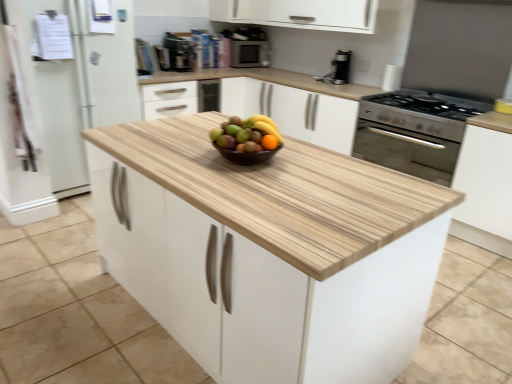
Measure the distance between natural wood cabinet at center, which is counted as the 3th cabinetry, starting from the back, and camera.

natural wood cabinet at center, which is counted as the 3th cabinetry, starting from the back, and camera are 3.87 feet apart.

What do you see at coordinates (271, 252) in the screenshot? This screenshot has width=512, height=384. I see `natural wood cabinet at center, marked as the first cabinetry in a front-to-back arrangement` at bounding box center [271, 252].

The height and width of the screenshot is (384, 512). Describe the element at coordinates (179, 53) in the screenshot. I see `black plastic coffee machine at upper center` at that location.

Locate an element on the screen. The width and height of the screenshot is (512, 384). natural wood cabinet at center, which is counted as the 3th cabinetry, starting from the back is located at coordinates (271, 252).

Is metallic silver microwave at upper center inside the boundaries of orange matte grapefruit at center, or outside?

metallic silver microwave at upper center is located beyond the bounds of orange matte grapefruit at center.

Is metallic silver microwave at upper center not close to orange matte grapefruit at center?

That's right, there is a large distance between metallic silver microwave at upper center and orange matte grapefruit at center.

Is metallic silver microwave at upper center wider than orange matte grapefruit at center?

Correct, the width of metallic silver microwave at upper center exceeds that of orange matte grapefruit at center.

Between point (243, 43) and point (271, 149), which one is positioned behind?

The point (243, 43) is more distant.

From the image's perspective, is satin black coffee maker at upper right located above or below black plastic coffee machine at upper center?

satin black coffee maker at upper right is situated lower than black plastic coffee machine at upper center in the image.

You are a GUI agent. You are given a task and a screenshot of the screen. Output one action in this format:
    pyautogui.click(x=<x>, y=<y>)
    Task: Click on the coffee machine behind the satin black coffee maker at upper right
    This screenshot has width=512, height=384.
    Given the screenshot: What is the action you would take?
    tap(179, 53)

Considering the sizes of objects satin black coffee maker at upper right and black plastic coffee machine at upper center in the image provided, who is bigger, satin black coffee maker at upper right or black plastic coffee machine at upper center?

With larger size is satin black coffee maker at upper right.

From a real-world perspective, between satin black coffee maker at upper right and black plastic coffee machine at upper center, who is vertically higher?

From a 3D spatial view, black plastic coffee machine at upper center is above.

Identify the location of coffee machine to the left of white wood cabinet at upper center, the 1th cabinetry from the top. (179, 53).

Is white wood cabinet at upper center, positioned as the first cabinetry in back-to-front order, not inside black plastic coffee machine at upper center?

white wood cabinet at upper center, positioned as the first cabinetry in back-to-front order, lies outside black plastic coffee machine at upper center's area.

In the scene shown: Which of these two, white wood cabinet at upper center, the 1th cabinetry from the top, or black plastic coffee machine at upper center, is smaller?

Smaller between the two is black plastic coffee machine at upper center.

Is white matte cabinet at right, the second cabinetry when ordered from back to front, oriented towards satin black coffee maker at upper right?

No, white matte cabinet at right, the second cabinetry when ordered from back to front, is not turned towards satin black coffee maker at upper right.

From the image's perspective, which one is positioned lower, white matte cabinet at right, the second cabinetry when ordered from back to front, or satin black coffee maker at upper right?

white matte cabinet at right, the second cabinetry when ordered from back to front, is shown below in the image.

Identify the location of the 2nd cabinetry to the right of the satin black coffee maker at upper right, counting from the anchor's position. pyautogui.click(x=485, y=184).

Are white matte cabinet at right, the second cabinetry when ordered from back to front, and satin black coffee maker at upper right making contact?

They are not placed beside each other.

From the image's perspective, which object appears higher, natural wood cabinet at center, marked as the third cabinetry in a top-to-bottom arrangement, or orange matte grapefruit at center?

orange matte grapefruit at center is shown above in the image.

Considering the relative sizes of natural wood cabinet at center, which ranks as the first cabinetry in bottom-to-top order, and orange matte grapefruit at center in the image provided, is natural wood cabinet at center, which ranks as the first cabinetry in bottom-to-top order, taller than orange matte grapefruit at center?

Yes, natural wood cabinet at center, which ranks as the first cabinetry in bottom-to-top order, is taller than orange matte grapefruit at center.

Locate an element on the screen. The width and height of the screenshot is (512, 384). cabinetry that is the 1st object to the right of the orange matte grapefruit at center, starting at the anchor is located at coordinates pyautogui.click(x=271, y=252).

Does natural wood cabinet at center, marked as the third cabinetry in a top-to-bottom arrangement, lie behind orange matte grapefruit at center?

No, it is not.

From the image's perspective, is orange matte grapefruit at center over white wood cabinet at upper center, positioned as the first cabinetry in back-to-front order?

No.

Does orange matte grapefruit at center appear on the right side of white wood cabinet at upper center, positioned as the first cabinetry in back-to-front order?

Correct, you'll find orange matte grapefruit at center to the right of white wood cabinet at upper center, positioned as the first cabinetry in back-to-front order.

How far apart are orange matte grapefruit at center and white wood cabinet at upper center, which ranks as the 3th cabinetry in bottom-to-top order?

orange matte grapefruit at center and white wood cabinet at upper center, which ranks as the 3th cabinetry in bottom-to-top order, are 2.86 meters apart.

At what (x,y) coordinates should I click in order to perform the action: click on grapefruit on the right side of white wood cabinet at upper center, positioned as the first cabinetry in back-to-front order. Please return your answer as a coordinate pair (x, y). Looking at the image, I should click on (247, 134).

From a real-world perspective, which object stands above the other?

In real-world perspective, satin black coffee maker at upper right is above.

Who is taller, metallic silver microwave at upper center or satin black coffee maker at upper right?

satin black coffee maker at upper right.

Can you tell me how much metallic silver microwave at upper center and satin black coffee maker at upper right differ in facing direction?

There is a 82.2-degree angle between the facing directions of metallic silver microwave at upper center and satin black coffee maker at upper right.

Between metallic silver microwave at upper center and satin black coffee maker at upper right, which one has smaller size?

Smaller between the two is satin black coffee maker at upper right.

Locate an element on the screen. The width and height of the screenshot is (512, 384). grapefruit lying on the right of metallic silver microwave at upper center is located at coordinates (247, 134).

You are a GUI agent. You are given a task and a screenshot of the screen. Output one action in this format:
    pyautogui.click(x=<x>, y=<y>)
    Task: Click on the coffee machine lying on the left of satin black coffee maker at upper right
    
    Given the screenshot: What is the action you would take?
    pyautogui.click(x=179, y=53)

When comparing their distances from metallic silver microwave at upper center, does natural wood cabinet at center, which is counted as the 3th cabinetry, starting from the back, or black plastic coffee machine at upper center seem closer?

black plastic coffee machine at upper center is closer to metallic silver microwave at upper center.

Looking at the image, which one is located closer to black plastic coffee machine at upper center, white matte cabinet at right, the 2th cabinetry from the bottom, or natural wood cabinet at center, marked as the first cabinetry in a front-to-back arrangement?

natural wood cabinet at center, marked as the first cabinetry in a front-to-back arrangement, is positioned closer to the anchor black plastic coffee machine at upper center.

Based on their spatial positions, is white wood cabinet at upper center, the 3th cabinetry in the front-to-back sequence, or metallic silver microwave at upper center closer to satin black coffee maker at upper right?

metallic silver microwave at upper center is closer to satin black coffee maker at upper right.

When comparing their distances from white matte cabinet at right, the 2th cabinetry from the bottom, does orange matte grapefruit at center or black plastic coffee machine at upper center seem further?

black plastic coffee machine at upper center is positioned further to the anchor white matte cabinet at right, the 2th cabinetry from the bottom.

From the image, which object appears to be nearer to white wood cabinet at upper center, positioned as the first cabinetry in back-to-front order, satin black coffee maker at upper right or metallic silver microwave at upper center?

The object closer to white wood cabinet at upper center, positioned as the first cabinetry in back-to-front order, is metallic silver microwave at upper center.

When comparing their distances from orange matte grapefruit at center, does metallic silver microwave at upper center or black plastic coffee machine at upper center seem closer?

black plastic coffee machine at upper center lies closer to orange matte grapefruit at center than the other object.

Based on the photo, estimate the real-world distances between objects in this image. Which object is closer to metallic silver microwave at upper center, black plastic coffee machine at upper center or white wood cabinet at upper center, positioned as the first cabinetry in back-to-front order?

white wood cabinet at upper center, positioned as the first cabinetry in back-to-front order, is closer to metallic silver microwave at upper center.

Based on the photo, when comparing their distances from black plastic coffee machine at upper center, does orange matte grapefruit at center or satin black coffee maker at upper right seem further?

Among the two, orange matte grapefruit at center is located further to black plastic coffee machine at upper center.

The height and width of the screenshot is (384, 512). Find the location of `appliance between white wood cabinet at upper center, the 1th cabinetry from the top, and white matte cabinet at right, placed as the 2th cabinetry when sorted from front to back`. appliance between white wood cabinet at upper center, the 1th cabinetry from the top, and white matte cabinet at right, placed as the 2th cabinetry when sorted from front to back is located at coordinates (249, 54).

You are a GUI agent. You are given a task and a screenshot of the screen. Output one action in this format:
    pyautogui.click(x=<x>, y=<y>)
    Task: Click on the grapefruit positioned between natural wood cabinet at center, which is counted as the 3th cabinetry, starting from the back, and white matte cabinet at right, placed as the 2th cabinetry when sorted from front to back, from near to far
    This screenshot has height=384, width=512.
    Given the screenshot: What is the action you would take?
    pyautogui.click(x=247, y=134)

Find the location of `cabinetry between black plastic coffee machine at upper center and satin black coffee maker at upper right in the horizontal direction`. cabinetry between black plastic coffee machine at upper center and satin black coffee maker at upper right in the horizontal direction is located at coordinates (239, 11).

Locate an element on the screen. Image resolution: width=512 pixels, height=384 pixels. kitchen appliance between orange matte grapefruit at center and metallic silver microwave at upper center from front to back is located at coordinates (338, 69).